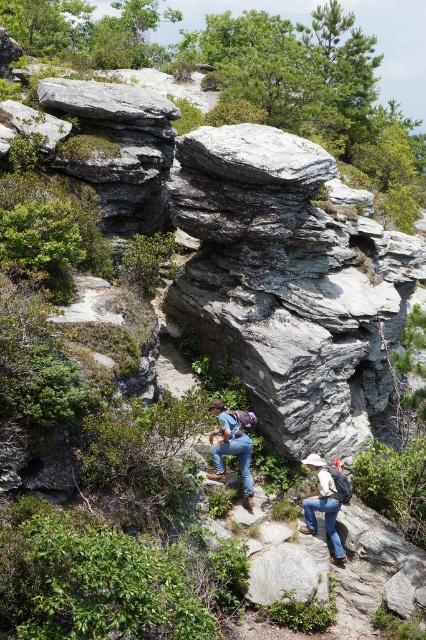
You are one of the hikers in the scene. You need to place your water bottle on a stable surface. Which object, the gray rough rock at upper center or the denim jeans at center, would be a better choice and why?

The gray rough rock at upper center is a better choice because it is positioned over the denim jeans at center, providing a more stable and elevated surface for placing the water bottle.

You are one of the hikers in the scene. You want to move from your current position to the gray rough rock at upper center. Which direction should you move relative to your denim jeans at center?

The gray rough rock at upper center is to the left of the denim jeans at center, so you should move to the left relative to your denim jeans at center.